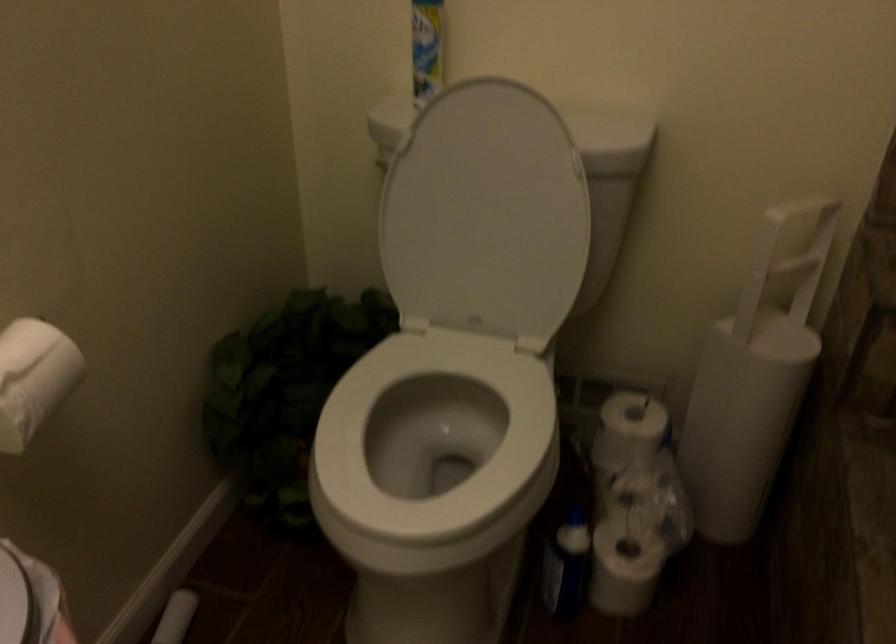
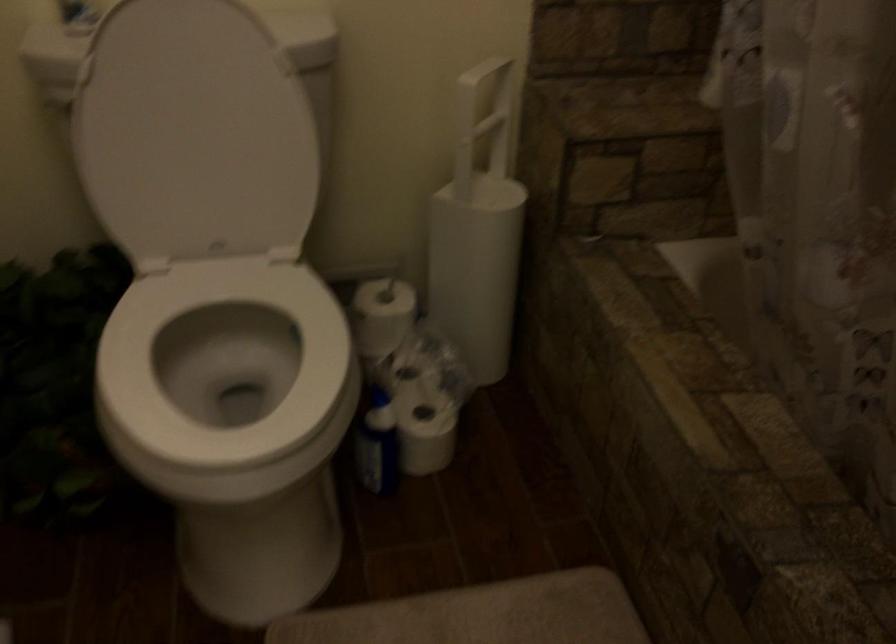
The point at (621,431) is marked in the first image. Where is the corresponding point in the second image?

(382, 316)